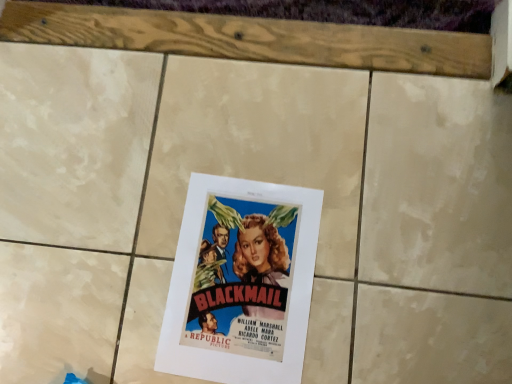
Question: Should I look upward or downward to see matte paper poster at center?

Choices:
 (A) down
 (B) up

Answer: (A)